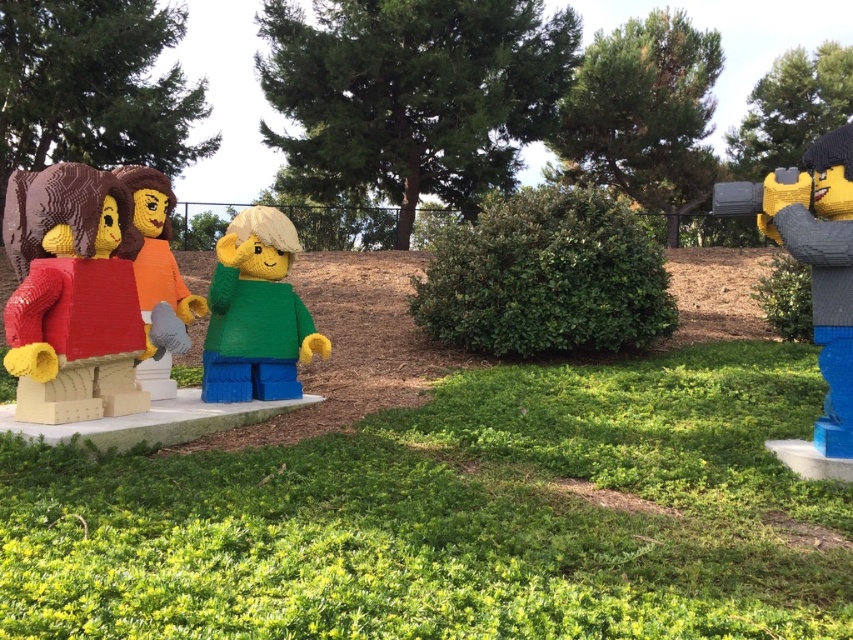
Question: From the image, what is the correct spatial relationship of green matte lego figure at center in relation to textured brown bear at left?

Choices:
 (A) right
 (B) left

Answer: (A)

Question: Based on their relative distances, which object is nearer to the green leafy hedge at right?

Choices:
 (A) green matte lego figure at center
 (B) matte red brick at left

Answer: (A)

Question: Is matte red brick at left positioned behind green matte lego figure at center?

Choices:
 (A) yes
 (B) no

Answer: (B)

Question: Is the position of green leafy bush at center more distant than that of textured brown bear at left?

Choices:
 (A) yes
 (B) no

Answer: (A)

Question: Which of the following is the farthest from the observer?

Choices:
 (A) (129, 358)
 (B) (817, 186)
 (C) (137, 253)
 (D) (3, 227)

Answer: (C)

Question: Which point is farther to the camera?

Choices:
 (A) brown woolen sweater at center
 (B) green matte lego figure at center
 (C) matte black helmet at right
 (D) green leafy hedge at right

Answer: (D)